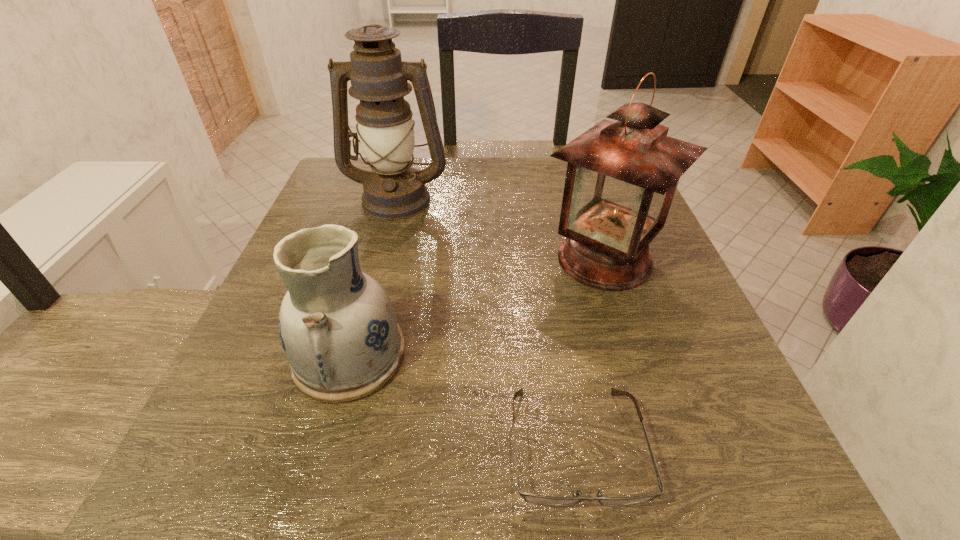
Locate an element on the screen. The height and width of the screenshot is (540, 960). object located in the near edge section of the desktop is located at coordinates (528, 497).

This screenshot has width=960, height=540. I want to click on oil lamp that is at the left edge, so click(x=394, y=190).

You are a GUI agent. You are given a task and a screenshot of the screen. Output one action in this format:
    pyautogui.click(x=<x>, y=<y>)
    Task: Click on the pottery that is at the left edge
    This screenshot has height=540, width=960.
    Given the screenshot: What is the action you would take?
    pyautogui.click(x=337, y=325)

Image resolution: width=960 pixels, height=540 pixels. In order to click on object situated at the right edge in this screenshot , I will do (x=622, y=175).

The width and height of the screenshot is (960, 540). Find the location of `object that is at the far left corner`. object that is at the far left corner is located at coordinates (x=394, y=190).

The image size is (960, 540). What are the coordinates of `vacant region at the far edge of the desktop` in the screenshot? It's located at (540, 191).

In the image, there is a desktop. At what (x,y) coordinates should I click in order to perform the action: click on vacant space at the near edge. Please return your answer as a coordinate pair (x, y). The width and height of the screenshot is (960, 540). Looking at the image, I should click on (387, 488).

The height and width of the screenshot is (540, 960). In the image, there is a desktop. Find the location of `vacant space at the left edge`. vacant space at the left edge is located at coordinates (254, 377).

The height and width of the screenshot is (540, 960). In the image, there is a desktop. What are the coordinates of `vacant area at the right edge` in the screenshot? It's located at (699, 417).

Image resolution: width=960 pixels, height=540 pixels. I want to click on vacant region at the far left corner of the desktop, so click(x=354, y=182).